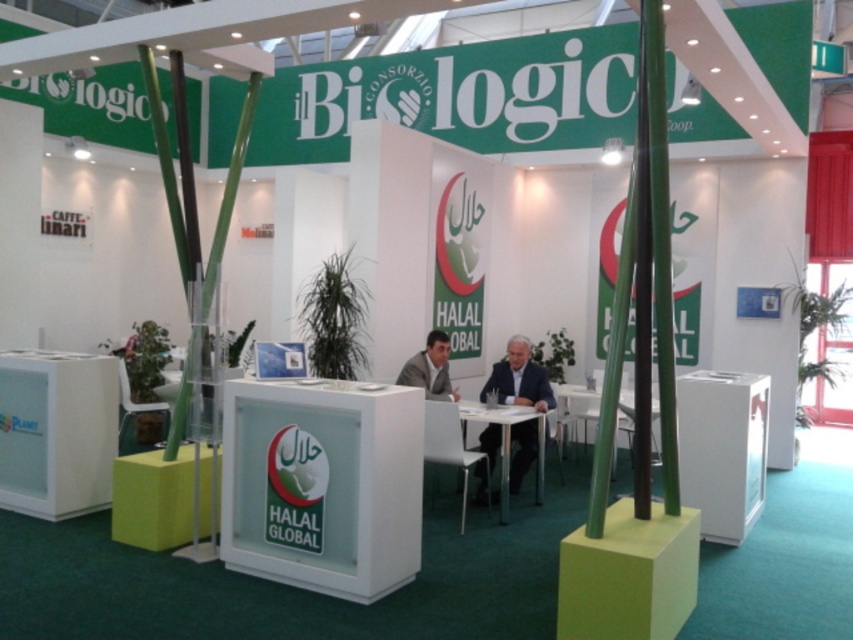
Question: Among these points, which one is nearest to the camera?

Choices:
 (A) (625, 432)
 (B) (515, 358)
 (C) (502, 486)

Answer: (C)

Question: Which is farther from the white glossy table at center?

Choices:
 (A) dark blue suit at center
 (B) white plastic table at center

Answer: (B)

Question: Does dark blue suit at center appear under white plastic table at center?

Choices:
 (A) yes
 (B) no

Answer: (B)

Question: Can you confirm if dark blue suit at center is positioned to the left of white glossy table at center?

Choices:
 (A) no
 (B) yes

Answer: (A)

Question: From the image, what is the correct spatial relationship of dark blue suit at center in relation to white glossy table at center?

Choices:
 (A) below
 (B) above

Answer: (B)

Question: Which object is farther from the camera taking this photo?

Choices:
 (A) white plastic table at center
 (B) white glossy table at center
 (C) dark blue suit at center

Answer: (C)